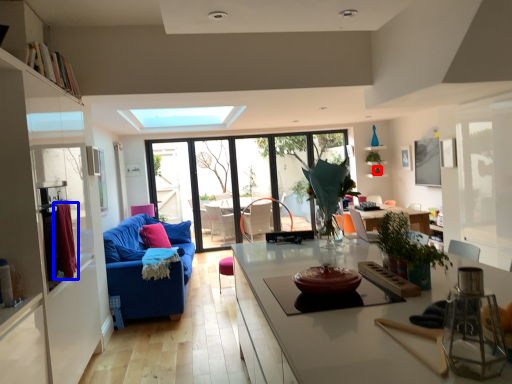
Question: Which point is further to the camera, plant (highlighted by a red box) or curtain (highlighted by a blue box)?

Choices:
 (A) plant
 (B) curtain

Answer: (A)